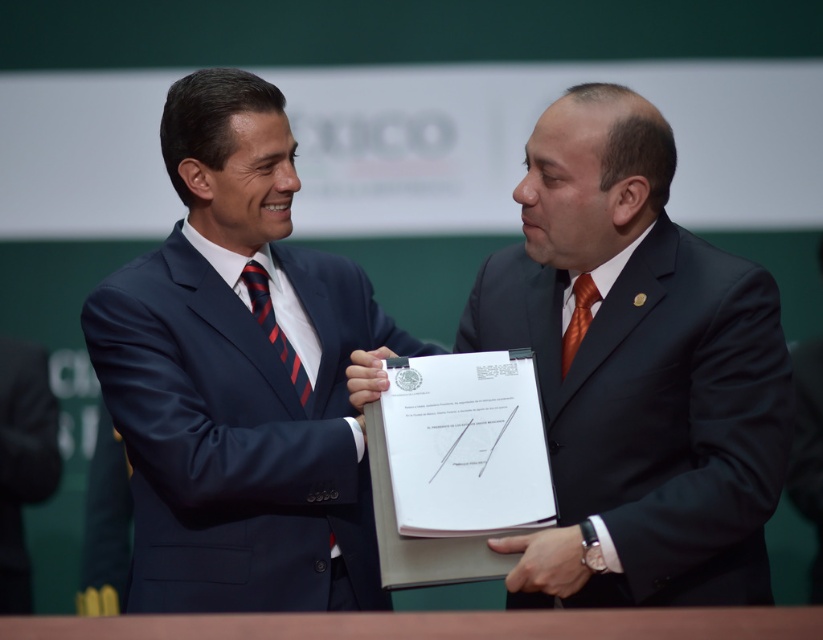
Question: Is the position of navy blue suit at center more distant than that of white paper clipboard at center?

Choices:
 (A) no
 (B) yes

Answer: (B)

Question: Is matte black suit at center positioned at the back of navy blue suit at center?

Choices:
 (A) yes
 (B) no

Answer: (B)

Question: Which point appears farthest from the camera in this image?

Choices:
 (A) (710, 324)
 (B) (573, 289)

Answer: (B)

Question: Estimate the real-world distances between objects in this image. Which object is farther from the white paper clipboard at center?

Choices:
 (A) navy blue suit at center
 (B) white paper at center
 (C) matte black suit at center

Answer: (A)

Question: Is white paper at center further to the viewer compared to striped silk tie at center?

Choices:
 (A) no
 (B) yes

Answer: (A)

Question: Which point is farther to the camera?

Choices:
 (A) (568, 548)
 (B) (524, 472)

Answer: (B)